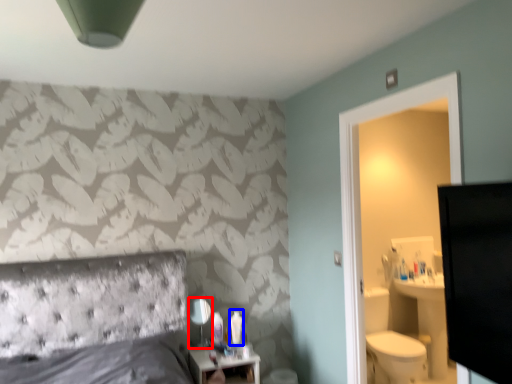
Question: Which of the following is the closest to the observer, mirror (highlighted by a red box) or toiletry (highlighted by a blue box)?

Choices:
 (A) mirror
 (B) toiletry

Answer: (A)